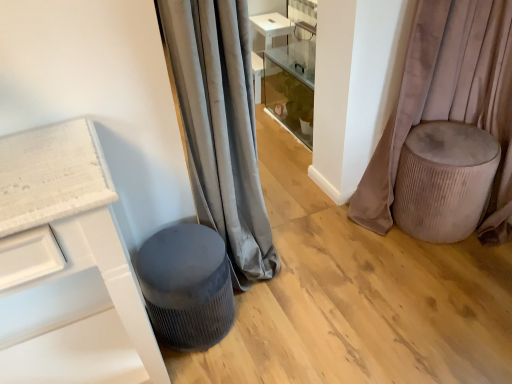
This screenshot has width=512, height=384. I want to click on free space above velvet grey stool at lower left (from a real-world perspective), so click(176, 249).